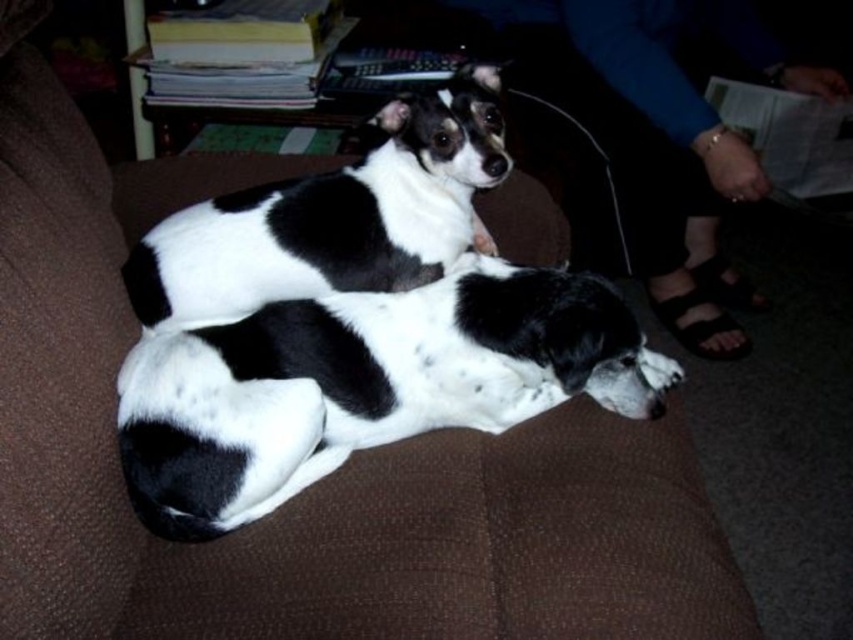
You are a photographer trying to capture both dogs in the image. Since the black and white fur at center and the black and white fur dog at center are both present, which one is blocking the other from view?

The black and white fur at center is positioned under the black and white fur dog at center, so the black and white fur dog at center is blocking the view of the black and white fur at center.

You are a photographer trying to capture both dogs in a single shot. The camera you are using has a limited depth of field that can only focus on objects within a 15 cm height range. Given that the black and white fur at center and the black and white fur dog at center are present, can both be in focus at the same time?

The black and white fur at center is not as tall as the black and white fur dog at center. The height difference between them is more than 15 cm, so they cannot both be in focus simultaneously with the camera settings described.